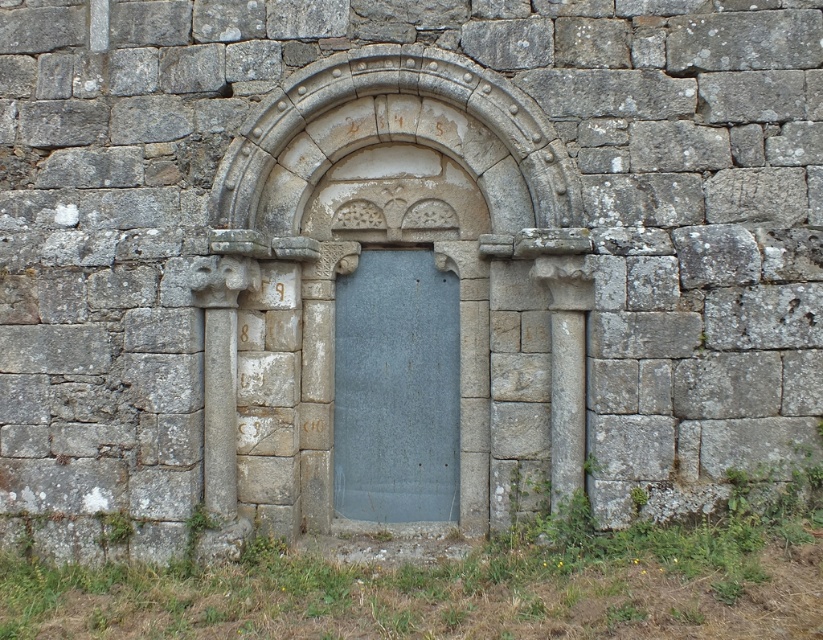
You are an archaeologist examining the ancient stone structure. You notice the stone archway at center and the blue stone door at center. Which object is positioned closer to your current viewpoint?

The stone archway at center is closer to the viewer than the blue stone door at center.

You are an architect examining an ancient structure. You notice the stone archway at center and the blue stone door at center. Which one has a greater height?

The stone archway at center is taller than the blue stone door at center.